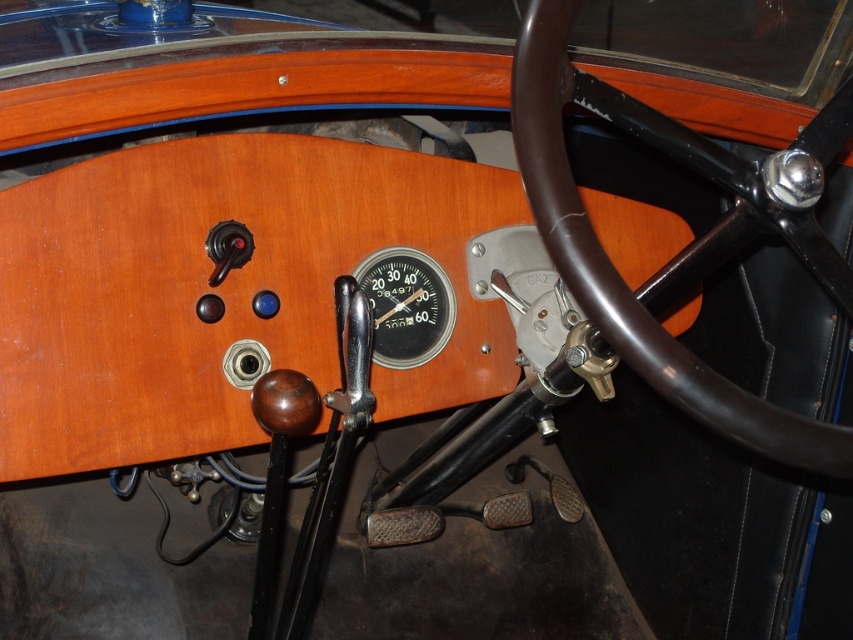
Does brown leather steering wheel at center have a lesser width compared to metallic silver gauge at center?

No.

Is brown leather steering wheel at center bigger than metallic silver gauge at center?

Yes, brown leather steering wheel at center is bigger than metallic silver gauge at center.

Who is more forward, (532, 168) or (448, 328)?

Point (532, 168) is more forward.

At what (x,y) coordinates should I click in order to perform the action: click on brown leather steering wheel at center. Please return your answer as a coordinate pair (x, y). This screenshot has height=640, width=853. Looking at the image, I should click on (622, 280).